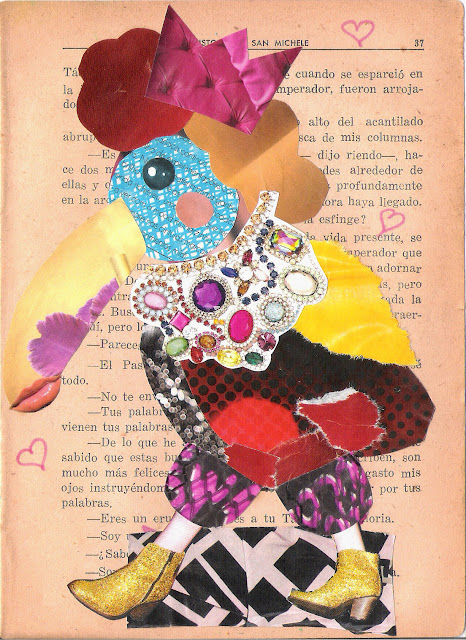
Where is `pillows`? Image resolution: width=466 pixels, height=640 pixels. pillows is located at coordinates (331, 540).